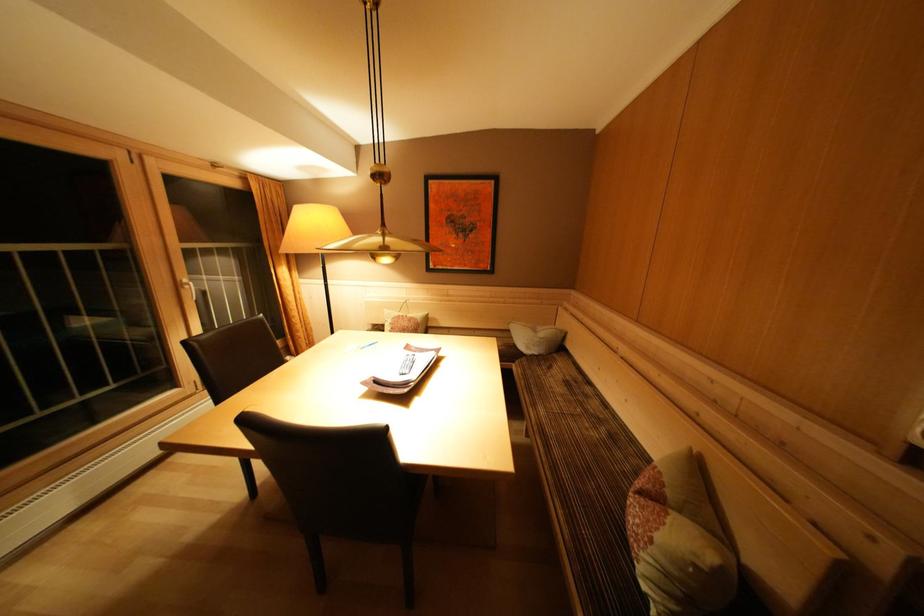
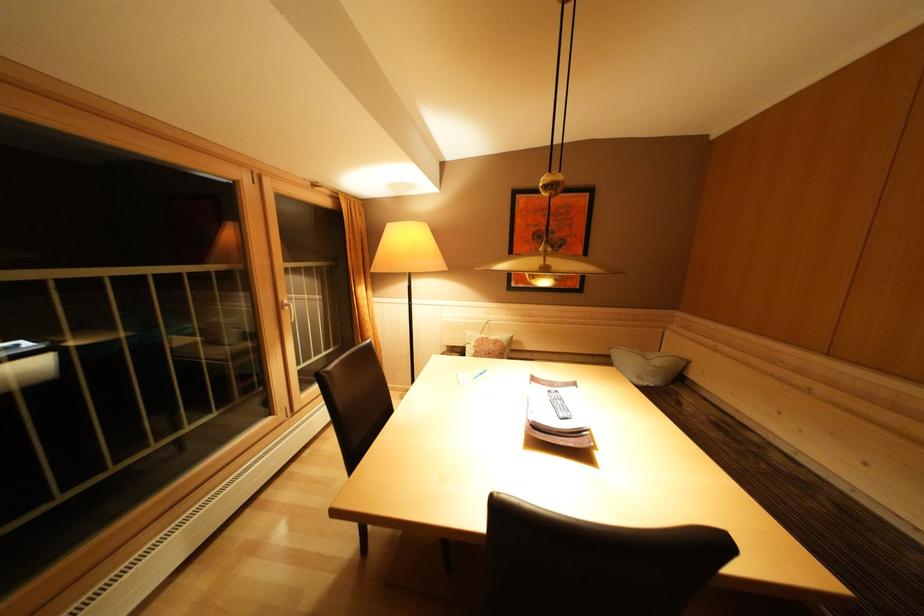
Question: The camera is either moving clockwise (left) or counter-clockwise (right) around the object. The first image is from the beginning of the video and the second image is from the end. Is the camera moving left or right when shooting the video?

Choices:
 (A) Left
 (B) Right

Answer: (B)